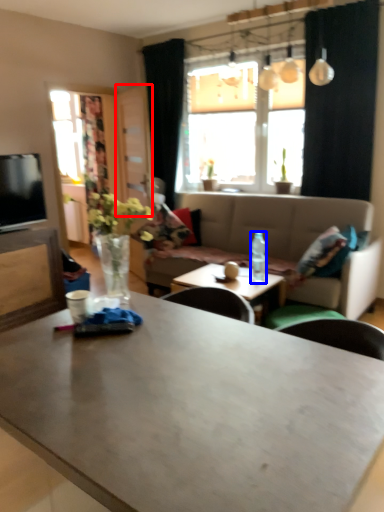
Question: Which of the following is the farthest to the observer, glass door (highlighted by a red box) or bottle (highlighted by a blue box)?

Choices:
 (A) glass door
 (B) bottle

Answer: (A)